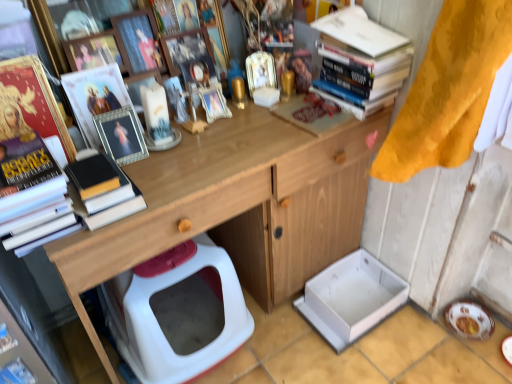
This screenshot has width=512, height=384. Identify the location of free space above wooden at upper center (from a real-world perspective). (228, 142).